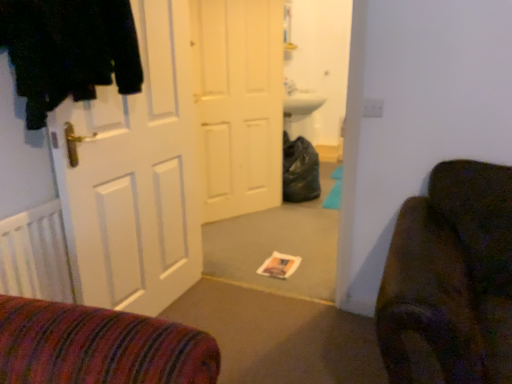
Question: From a real-world perspective, is white matte door at left, which ranks as the 2th door in back-to-front order, located higher than white matte door at center, which is the second door in front-to-back order?

Choices:
 (A) yes
 (B) no

Answer: (B)

Question: Is white matte door at left, which ranks as the 2th door in back-to-front order, far away from white matte door at center, which is the second door in front-to-back order?

Choices:
 (A) yes
 (B) no

Answer: (A)

Question: From a real-world perspective, is white matte door at left, which appears as the first door when viewed from the front, physically below white matte door at center, arranged as the first door when viewed from the back?

Choices:
 (A) no
 (B) yes

Answer: (B)

Question: Is white matte door at left, which appears as the first door when viewed from the front, smaller than white matte door at center, which is the second door in front-to-back order?

Choices:
 (A) no
 (B) yes

Answer: (B)

Question: Can you confirm if white matte door at left, which appears as the first door when viewed from the front, is positioned to the right of white matte door at center, arranged as the first door when viewed from the back?

Choices:
 (A) no
 (B) yes

Answer: (A)

Question: Does white matte door at left, which appears as the first door when viewed from the front, have a larger size compared to white matte door at center, which is the second door in front-to-back order?

Choices:
 (A) yes
 (B) no

Answer: (B)

Question: Does white matte door at center, arranged as the first door when viewed from the back, have a larger size compared to white matte door at left, which ranks as the 2th door in back-to-front order?

Choices:
 (A) yes
 (B) no

Answer: (A)

Question: From a real-world perspective, is white matte door at center, arranged as the first door when viewed from the back, beneath white matte door at left, which appears as the first door when viewed from the front?

Choices:
 (A) no
 (B) yes

Answer: (A)

Question: From the image's perspective, does white matte door at center, which is the second door in front-to-back order, appear lower than white matte door at left, which appears as the first door when viewed from the front?

Choices:
 (A) yes
 (B) no

Answer: (B)

Question: Can white matte door at left, which ranks as the 2th door in back-to-front order, be found inside white matte door at center, which is the second door in front-to-back order?

Choices:
 (A) no
 (B) yes

Answer: (A)

Question: Does white matte door at center, arranged as the first door when viewed from the back, appear on the left side of white matte door at left, which appears as the first door when viewed from the front?

Choices:
 (A) no
 (B) yes

Answer: (A)

Question: Can you see white matte door at center, which is the second door in front-to-back order, touching white matte door at left, which appears as the first door when viewed from the front?

Choices:
 (A) yes
 (B) no

Answer: (B)

Question: Does white matte door at center, which is the second door in front-to-back order, touch black fuzzy coat at left?

Choices:
 (A) yes
 (B) no

Answer: (B)